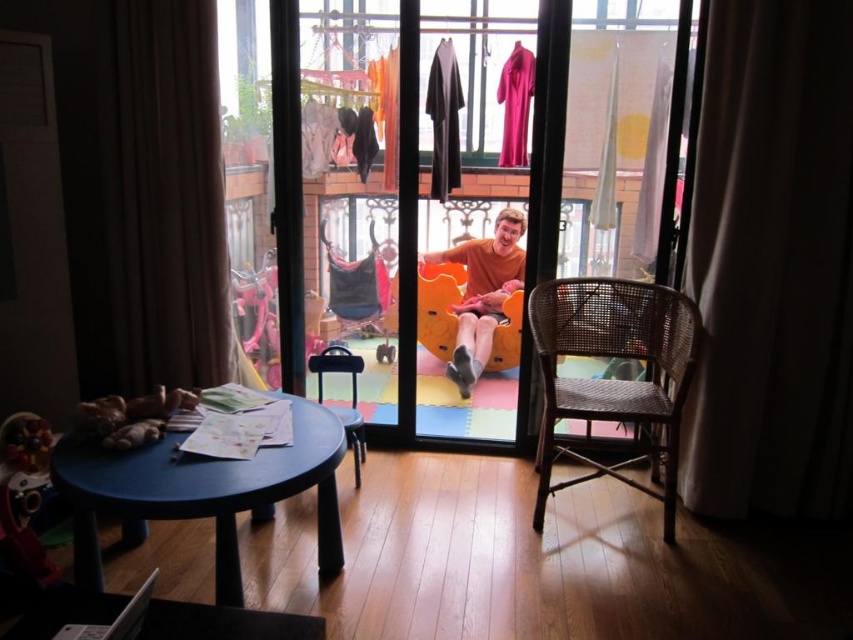
You are trying to exit through the transparent plastic glass door at center but notice the white fabric curtain at right might block your way. Based on their positions, can you determine if the curtain is in front of or behind the door?

The transparent plastic glass door at center is above the white fabric curtain at right, so the curtain is behind the door and won not block your path.

You are organizing a small party and need to decide where to place a new decorative item. The brown cotton shirt at center and the soft plush toys at lower left are already present. Which object takes up more horizontal space in the scene?

The brown cotton shirt at center is wider than the soft plush toys at lower left, so it takes up more horizontal space.